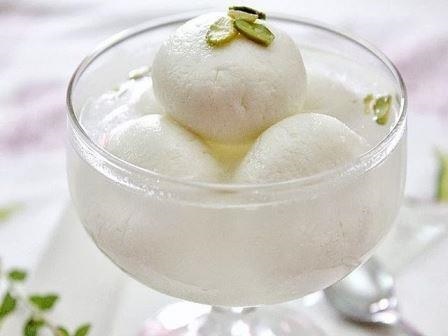
The image size is (448, 336). I want to click on plant, so click(x=41, y=300).